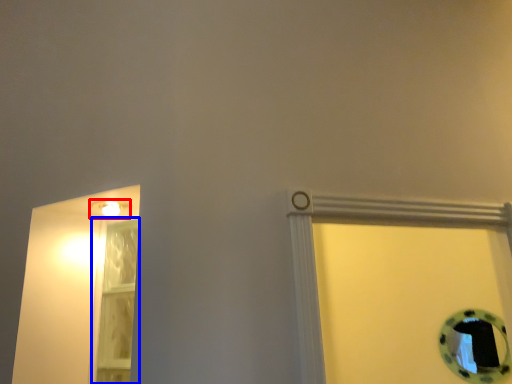
Question: Which object appears farthest to the camera in this image, light fixture (highlighted by a red box) or glass door (highlighted by a blue box)?

Choices:
 (A) light fixture
 (B) glass door

Answer: (B)